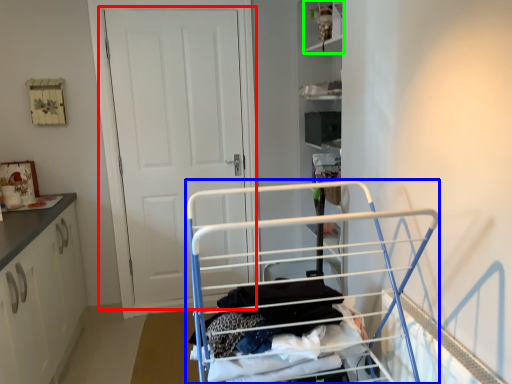
Question: Which object is the farthest from door (highlighted by a red box)? Choose among these: baby carriage (highlighted by a blue box) or cabinet (highlighted by a green box).

Choices:
 (A) baby carriage
 (B) cabinet

Answer: (A)